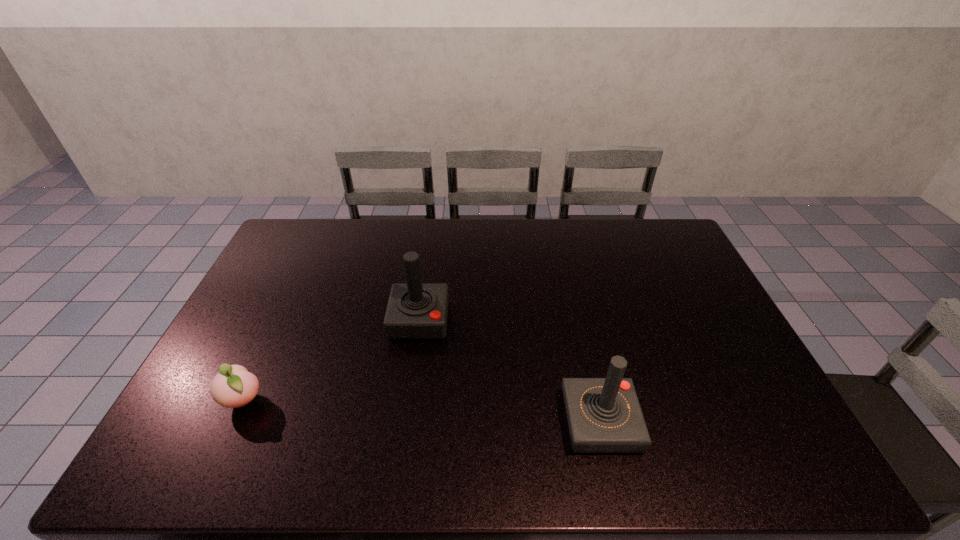
This screenshot has width=960, height=540. Find the location of `the farthest object`. the farthest object is located at coordinates (414, 311).

Where is `the left joystick`? the left joystick is located at coordinates (414, 311).

At what (x,y) coordinates should I click in order to perform the action: click on the nearer joystick. Please return your answer as a coordinate pair (x, y). Image resolution: width=960 pixels, height=540 pixels. Looking at the image, I should click on (604, 415).

What are the coordinates of `the rightmost object` in the screenshot? It's located at (604, 415).

The image size is (960, 540). I want to click on the leftmost object, so click(x=233, y=386).

You are a GUI agent. You are given a task and a screenshot of the screen. Output one action in this format:
    pyautogui.click(x=<x>, y=<y>)
    Task: Click on the peach
    The width and height of the screenshot is (960, 540).
    Given the screenshot: What is the action you would take?
    pyautogui.click(x=233, y=386)

This screenshot has height=540, width=960. What are the coordinates of `vacant space located on the base of the farthest object` in the screenshot? It's located at (404, 429).

Identify the location of free location located on the rectangular base of the rightmost object. (537, 423).

Locate an element on the screen. This screenshot has width=960, height=540. vacant region located 0.240m on the rectangular base of the rightmost object is located at coordinates (468, 423).

Image resolution: width=960 pixels, height=540 pixels. I want to click on vacant area located 0.390m on the rectangular base of the rightmost object, so click(408, 423).